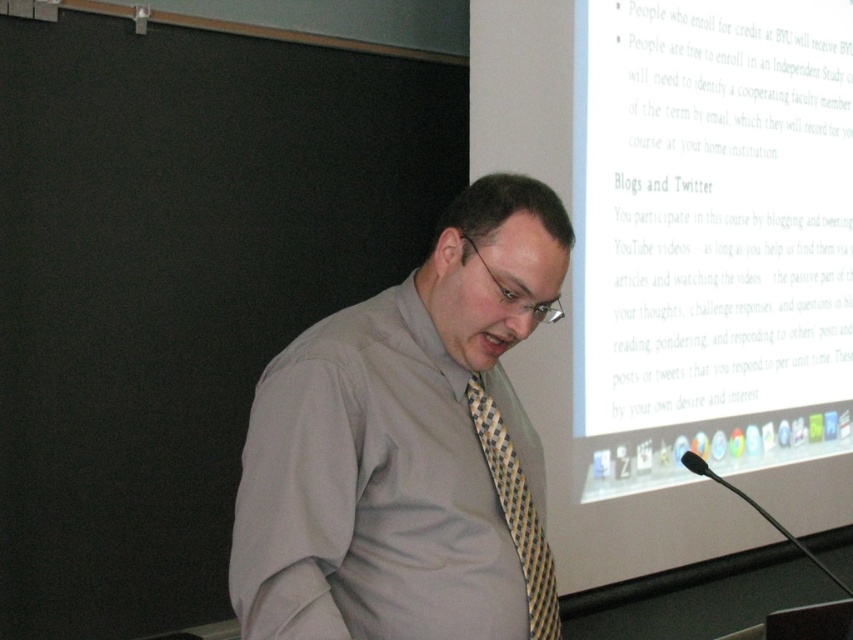
Question: Does gray fabric shirt at center have a smaller size compared to yellow and black woven tie at center?

Choices:
 (A) no
 (B) yes

Answer: (A)

Question: Can you confirm if gray fabric shirt at center is positioned above yellow and black woven tie at center?

Choices:
 (A) no
 (B) yes

Answer: (B)

Question: Is gray fabric shirt at center in front of yellow and black woven tie at center?

Choices:
 (A) no
 (B) yes

Answer: (B)

Question: Which point is closer to the camera taking this photo?

Choices:
 (A) (399, 490)
 (B) (518, 484)

Answer: (A)